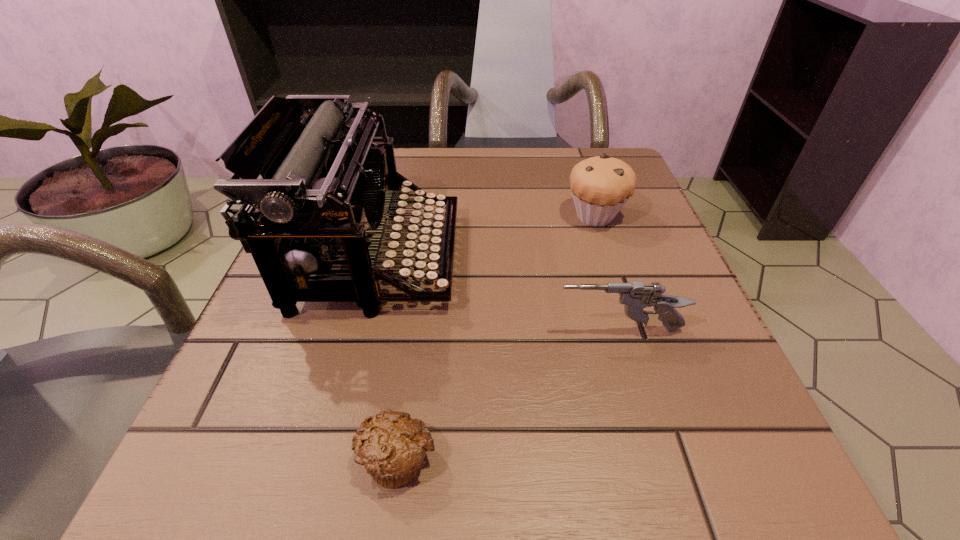
At what (x,y) coordinates should I click in order to perform the action: click on the tallest object. Please return your answer as a coordinate pair (x, y). The height and width of the screenshot is (540, 960). Looking at the image, I should click on (322, 190).

The height and width of the screenshot is (540, 960). In order to click on the taller muffin in this screenshot , I will do `click(601, 185)`.

This screenshot has height=540, width=960. Identify the location of the farther muffin. (601, 185).

Where is `the third tallest object`? The height and width of the screenshot is (540, 960). the third tallest object is located at coordinates (636, 296).

The height and width of the screenshot is (540, 960). I want to click on the left muffin, so click(391, 447).

Locate an element on the screen. the nearest object is located at coordinates click(391, 447).

Locate an element on the screen. This screenshot has width=960, height=540. free region located on the typing side of the tallest object is located at coordinates point(548,258).

This screenshot has height=540, width=960. I want to click on vacant space located 0.050m on the front of the second tallest object, so click(608, 252).

Image resolution: width=960 pixels, height=540 pixels. Identify the location of vacant area located 0.120m at the barrel of the third tallest object. (474, 330).

Image resolution: width=960 pixels, height=540 pixels. What are the coordinates of `free region located at the barrel of the third tallest object` in the screenshot? It's located at (398, 330).